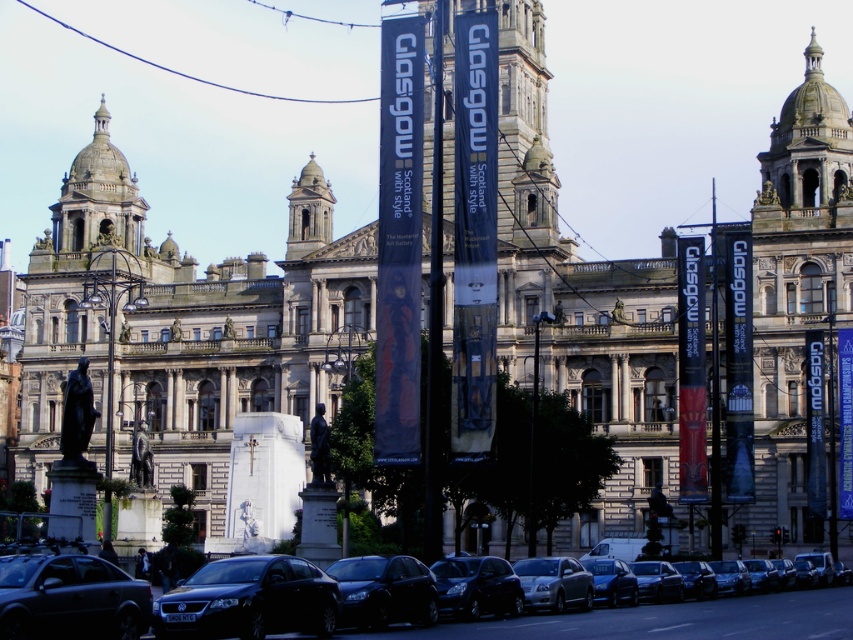
Question: Does shiny black sedan at lower left appear on the right side of silver metallic sedan at center?

Choices:
 (A) no
 (B) yes

Answer: (A)

Question: Can you confirm if black glossy car at lower center is positioned to the left of shiny black car at center?

Choices:
 (A) yes
 (B) no

Answer: (B)

Question: Is black glossy car at lower center above shiny black sedan at lower left?

Choices:
 (A) yes
 (B) no

Answer: (A)

Question: Which object is positioned closest to the black glossy car at lower center?

Choices:
 (A) shiny black sedan at center
 (B) shiny black car at center

Answer: (A)

Question: Estimate the real-world distances between objects in this image. Which object is closer to the silver metallic sedan at center?

Choices:
 (A) black glossy car at lower center
 (B) shiny black sedan at lower left

Answer: (A)

Question: Based on their relative distances, which object is nearer to the black glossy car at lower center?

Choices:
 (A) polished stone tower at upper right
 (B) shiny black sedan at lower center
 (C) shiny black sedan at lower left

Answer: (B)